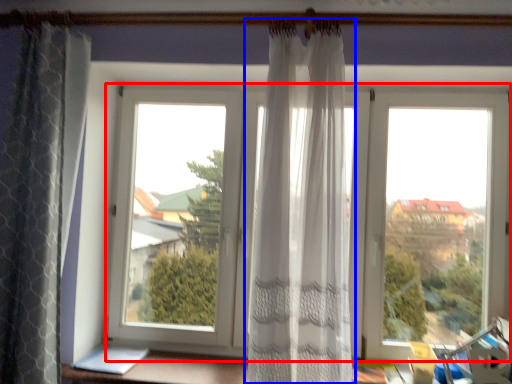
Question: Which object appears closest to the camera in this image, window (highlighted by a red box) or curtain (highlighted by a blue box)?

Choices:
 (A) window
 (B) curtain

Answer: (B)